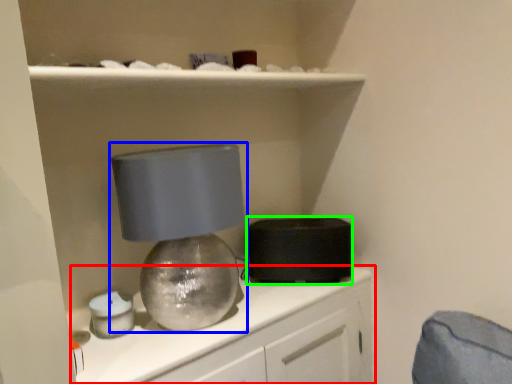
Question: Which object is the closest to the cabinetry (highlighted by a red box)? Choose among these: lamp (highlighted by a blue box) or appliance (highlighted by a green box).

Choices:
 (A) lamp
 (B) appliance

Answer: (B)